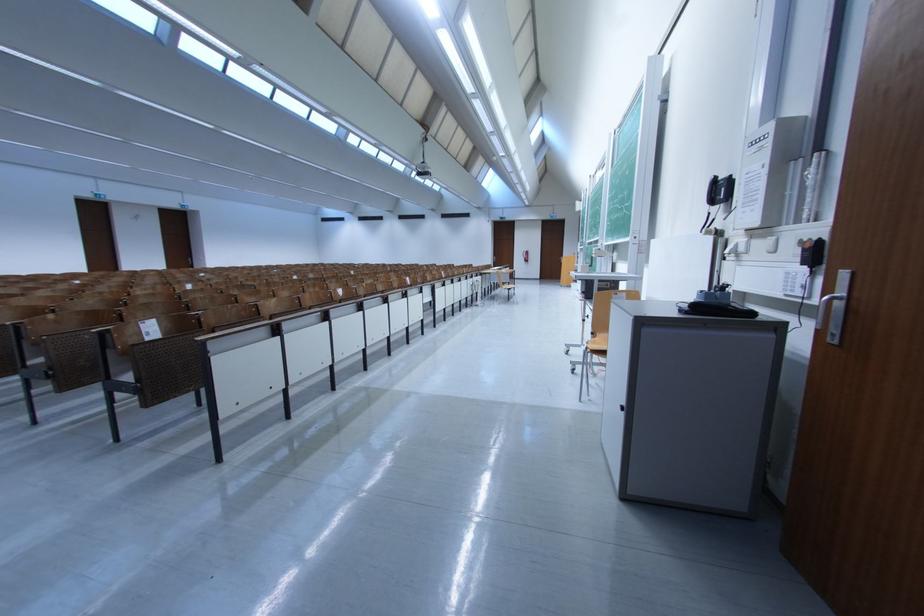
Image resolution: width=924 pixels, height=616 pixels. Find the location of `metal door handle`. metal door handle is located at coordinates (824, 307).